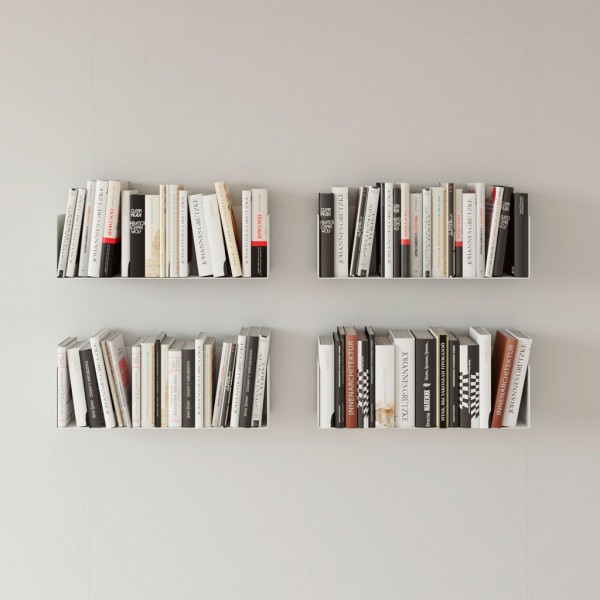
The width and height of the screenshot is (600, 600). Find the location of `book shelf end`. book shelf end is located at coordinates (271, 395), (54, 395), (62, 229), (268, 233), (528, 245), (536, 383), (318, 395).